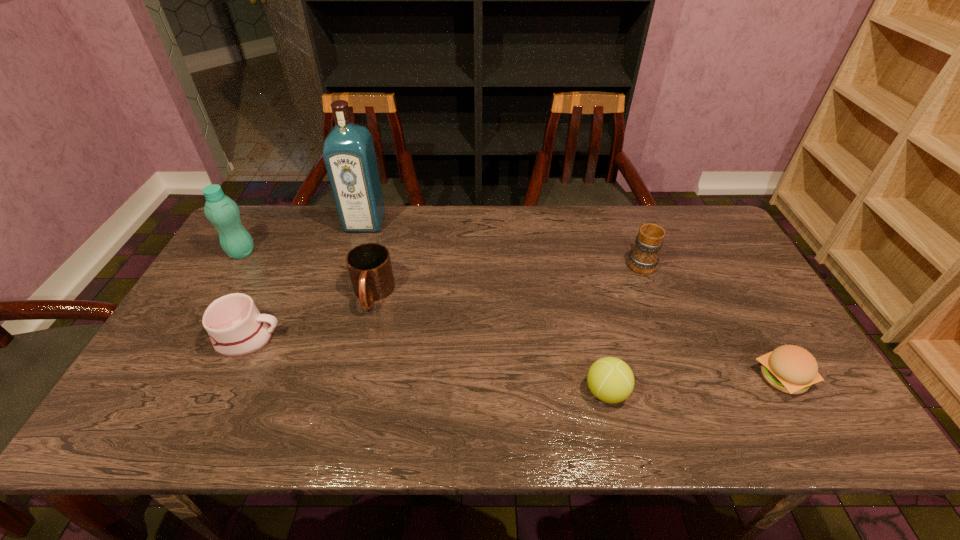
I want to click on the farthest object, so click(349, 154).

You are a GUI agent. You are given a task and a screenshot of the screen. Output one action in this format:
    pyautogui.click(x=<x>, y=<y>)
    Task: Click on the liquor
    The image size is (960, 540).
    Given the screenshot: What is the action you would take?
    tap(349, 154)

In order to click on the second tallest object in this screenshot , I will do `click(220, 210)`.

Locate an element on the screen. the leftmost object is located at coordinates (220, 210).

Find the location of `the sixth object from left to right`. the sixth object from left to right is located at coordinates (643, 258).

You are a GUI agent. You are given a task and a screenshot of the screen. Output one action in this format:
    pyautogui.click(x=<x>, y=<y>)
    Task: Click on the second mug from left to right
    
    Given the screenshot: What is the action you would take?
    pyautogui.click(x=369, y=265)

Where is `the sixth object from right to left`? Image resolution: width=960 pixels, height=540 pixels. the sixth object from right to left is located at coordinates (236, 328).

I want to click on the leftmost mug, so click(236, 328).

The width and height of the screenshot is (960, 540). Identify the location of tennis ball. (611, 380).

The image size is (960, 540). I want to click on hamburger, so click(791, 369).